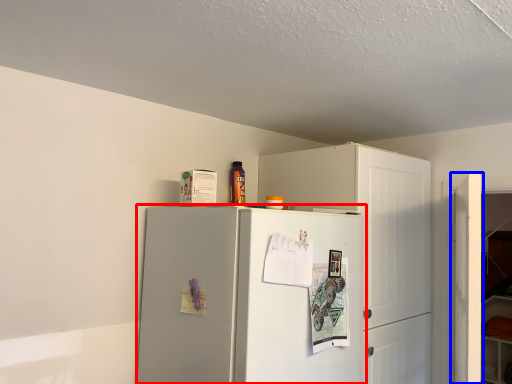
Question: Which of the following is the farthest to the observer, refrigerator (highlighted by a red box) or door (highlighted by a blue box)?

Choices:
 (A) refrigerator
 (B) door

Answer: (B)